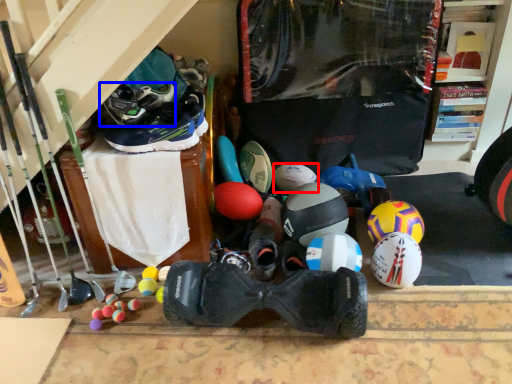
Question: Among these objects, which one is farthest to the camera, ball (highlighted by a red box) or footwear (highlighted by a blue box)?

Choices:
 (A) ball
 (B) footwear

Answer: (A)